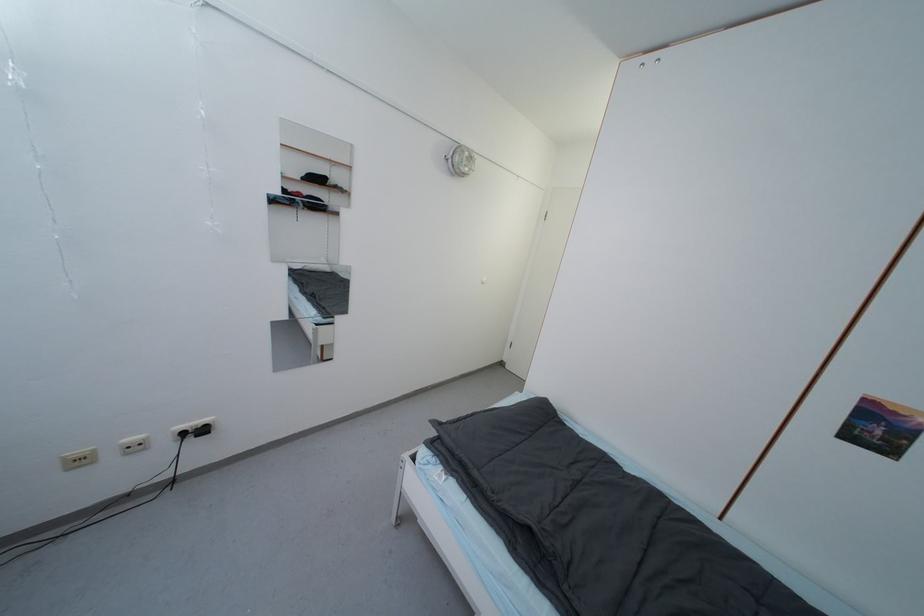
Find the location of a particular element. Image resolution: width=924 pixels, height=616 pixels. white wall button is located at coordinates (482, 280).